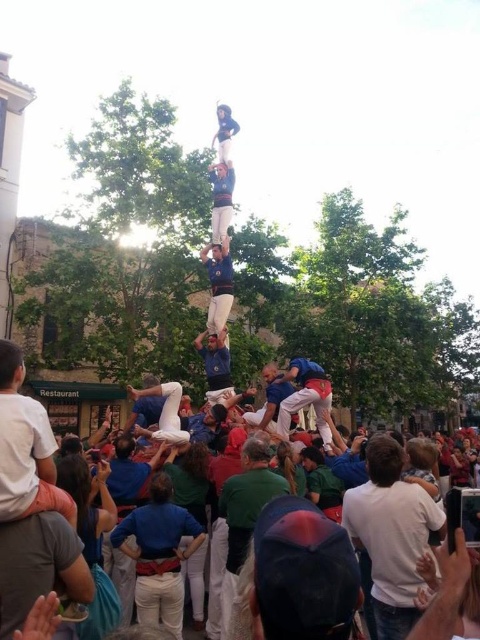
You are a photographer at the event and want to capture the human tower. You notice the white cotton shirt at lower left and the white cotton crowd at lower center. Which object is taller in the image?

The white cotton shirt at lower left is much taller as white cotton crowd at lower center.

From the picture: You are a photographer at the event and want to capture the human tower. You notice the white cotton shirt at center and the blue fabric at center. Which of these two items is wider in the image?

The white cotton shirt at center might be wider than blue fabric at center.